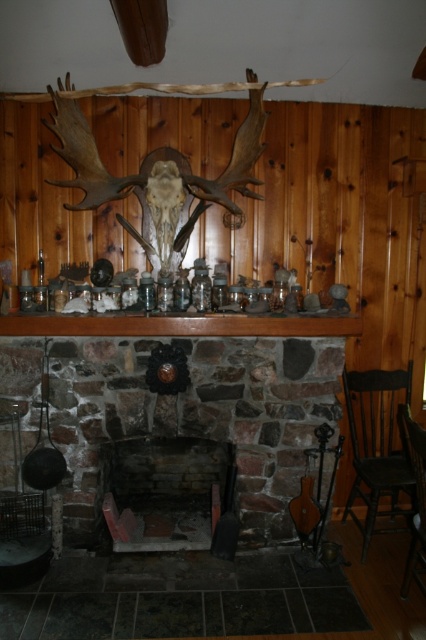
You are sitting in the dark brown wooden chair at right and want to move to the black wood chair at right. In which direction should you move to reach it?

You should move to the right because the dark brown wooden chair at right is to the left of the black wood chair at right.

You are planning to place a new decorative item on the mantel of the brick fireplace at center. However, you need to ensure it will fit between the mounted deer skull and the dark brown wooden chair at right. Can you determine if there is enough space?

The brick fireplace at center might be wider than dark brown wooden chair at right, so there might be sufficient space between them for the decorative item.